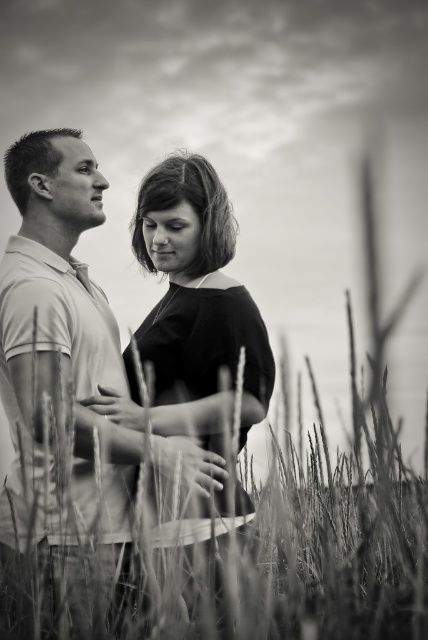
You are a photographer trying to capture the smooth black dress at center in a photo. Since the dress is placed over the fuzzy grass at center, will the grass be visible underneath the dress in the final image?

The smooth black dress at center is positioned over fuzzy grass at center, so the grass may not be fully visible underneath the dress depending on its transparency and the lighting conditions. However, since the dress is described as smooth and the grass as fuzzy, there might be some texture contrast that could reveal the grass beneath.

You are a photographer trying to capture a clear shot of the smooth black dress at center and the fuzzy grass at center. Which object will appear taller in the photo?

The smooth black dress at center is much taller than the fuzzy grass at center, so it will appear taller in the photo.

You are a photographer trying to capture a closeup of the smooth black dress at center and the fuzzy grass at center. What is the minimum distance you need to set your camera lens to focus on both objects clearly?

The minimum distance needed is 25.96 inches between smooth black dress at center and fuzzy grass at center to focus both objects clearly.